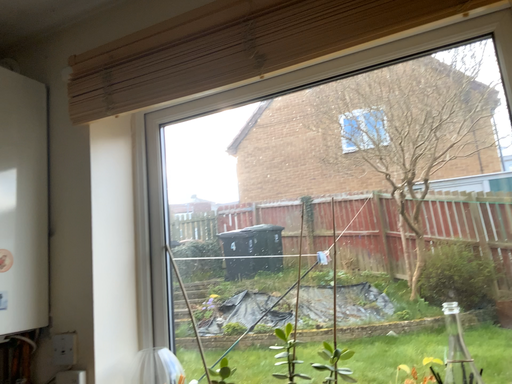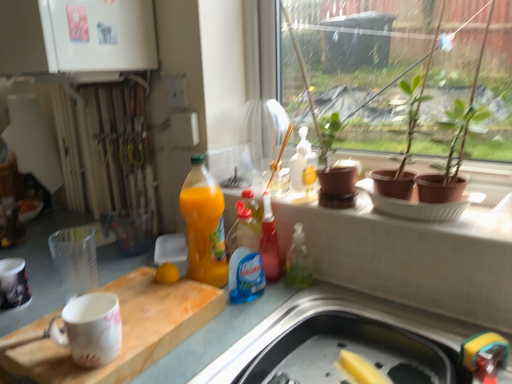
Question: How did the camera likely rotate when shooting the video?

Choices:
 (A) rotated upward
 (B) rotated downward

Answer: (B)